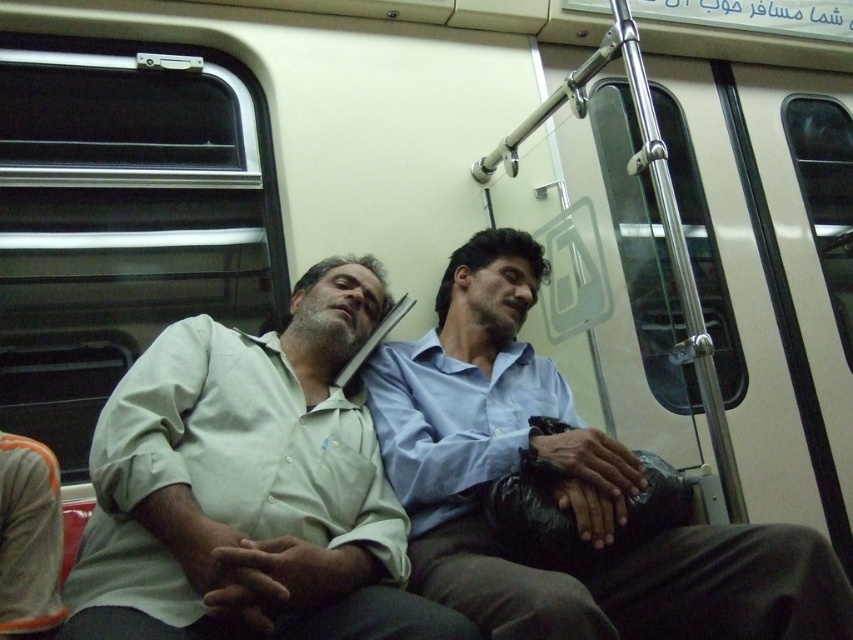
You are a delivery robot with a package that needs to be placed at point (247, 584). Your current position is 1.06 meters away from that point. Can you reach the point to drop off the package?

The point (247, 584) is 1.06 meters away from the camera, so yes, the robot can reach the point to drop off the package since it is within the robot delivery range.

You are a passenger on a train and want to place a small item on the seat between the two points labeled point [252,387] and point [402,472]. Which point should you choose to ensure the item is closer to you?

You should place the item closer to point [252,387] because it is closer to the camera than point [402,472].

You are a clothing designer analyzing the image of two people in a train car. You need to determine which of the two shirts, the light green cotton shirt at center or the blue smooth shirt at center, would be more suitable for a summer collection based on their fabric thickness. Which one would you choose and why?

The light green cotton shirt at center is thinner than the blue smooth shirt at center, making it more breathable and suitable for a summer collection.